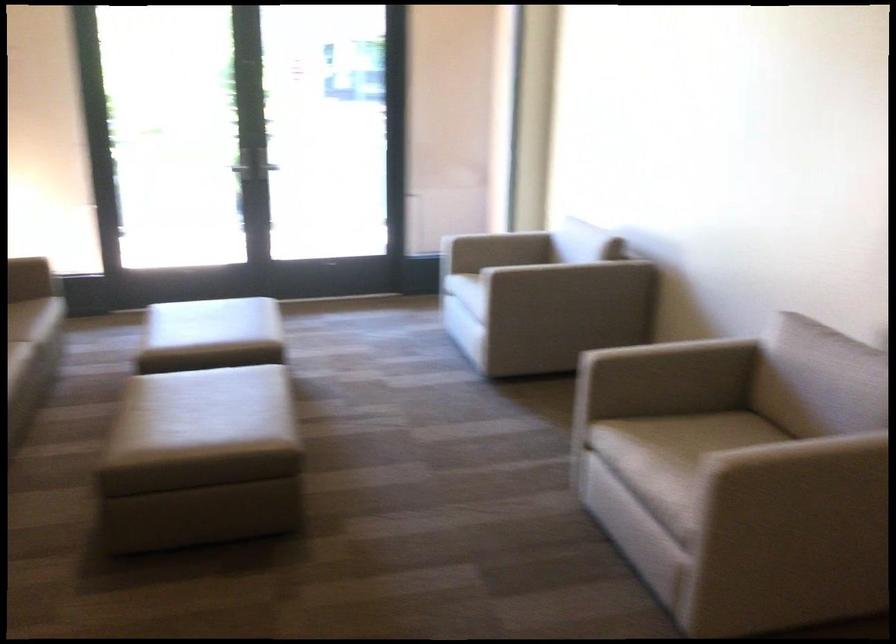
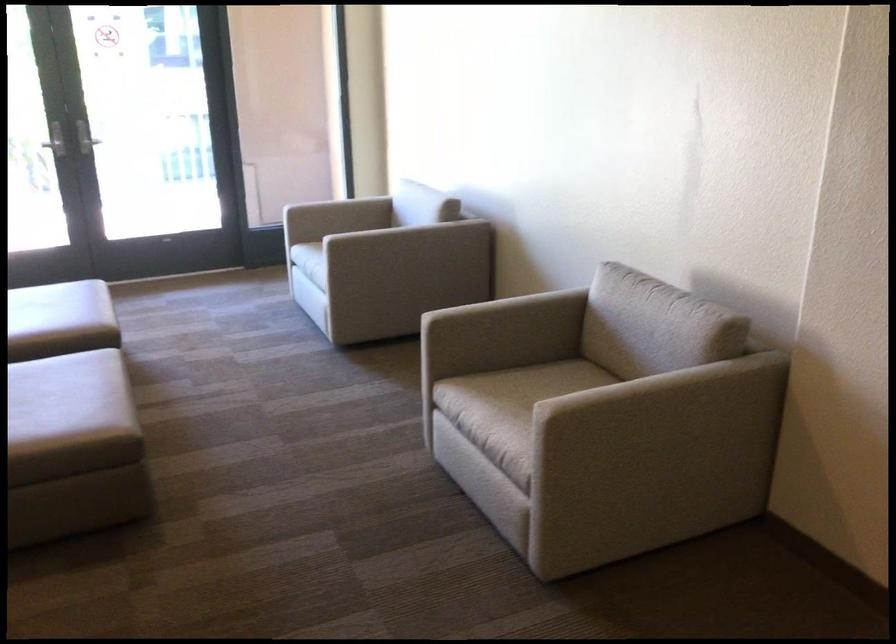
In the second image, find the point that corresponds to point 533,236 in the first image.

(375, 200)